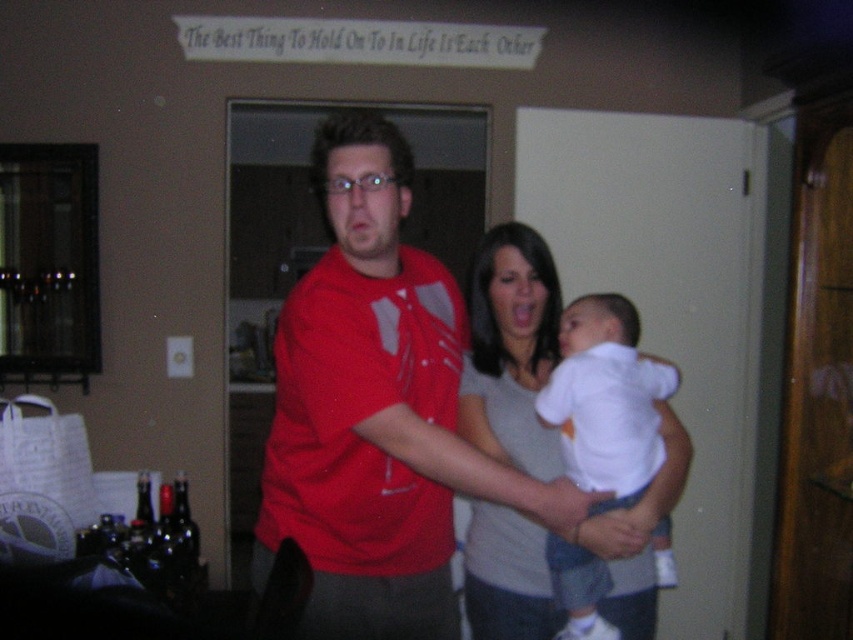
Who is taller, matte red shirt at center or white soft fabric baby at center?

Standing taller between the two is matte red shirt at center.

Is matte red shirt at center thinner than white soft fabric baby at center?

In fact, matte red shirt at center might be wider than white soft fabric baby at center.

Locate an element on the screen. matte red shirt at center is located at coordinates (376, 410).